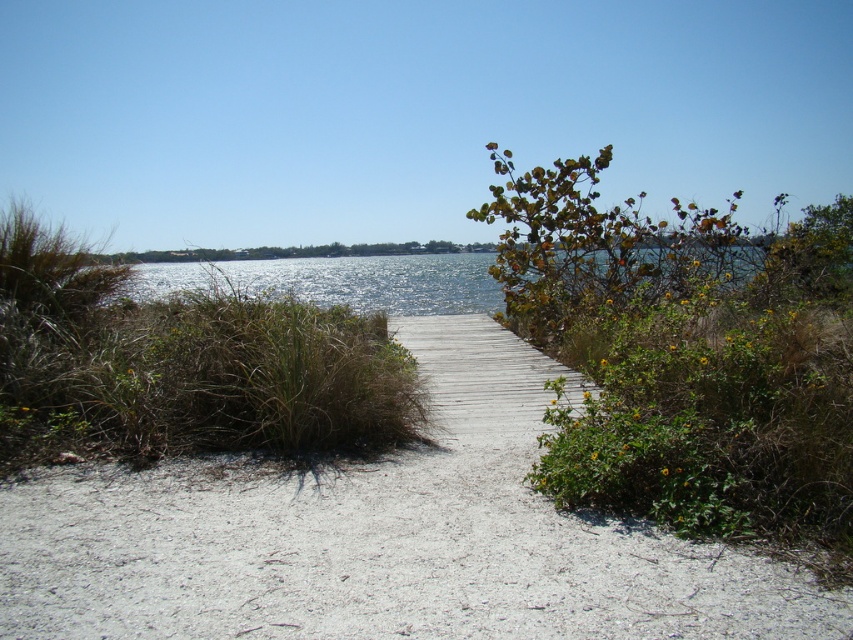
Who is taller, white sandy path at center or green grass at center?

green grass at center is taller.

Is white sandy path at center below green grass at center?

Correct, white sandy path at center is located below green grass at center.

The width and height of the screenshot is (853, 640). What do you see at coordinates (381, 538) in the screenshot? I see `white sandy path at center` at bounding box center [381, 538].

Find the location of a particular element. Image resolution: width=853 pixels, height=640 pixels. white sandy path at center is located at coordinates (381, 538).

From the picture: Between white sandy path at center and glistening blue water at center, which one appears on the right side from the viewer's perspective?

From the viewer's perspective, white sandy path at center appears more on the right side.

Is white sandy path at center closer to the viewer compared to glistening blue water at center?

Yes, it is in front of glistening blue water at center.

Describe the element at coordinates (381, 538) in the screenshot. The image size is (853, 640). I see `white sandy path at center` at that location.

Locate an element on the screen. Image resolution: width=853 pixels, height=640 pixels. white sandy path at center is located at coordinates (381, 538).

Can you confirm if green leafy bush at upper right is smaller than glistening blue water at center?

Incorrect, green leafy bush at upper right is not smaller in size than glistening blue water at center.

Find the location of `green leafy bush at upper right`. green leafy bush at upper right is located at coordinates (688, 356).

You are a GUI agent. You are given a task and a screenshot of the screen. Output one action in this format:
    pyautogui.click(x=<x>, y=<y>)
    Task: Click on the green leafy bush at upper right
    The width and height of the screenshot is (853, 640).
    Given the screenshot: What is the action you would take?
    pyautogui.click(x=688, y=356)